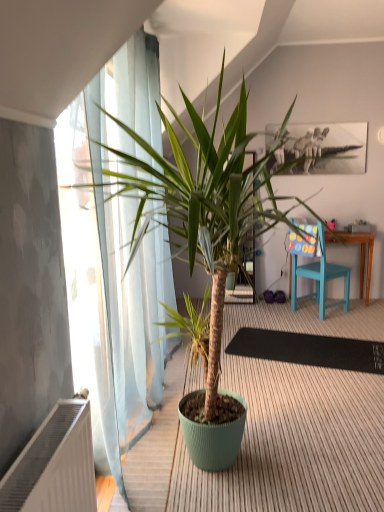
Locate an element on the screen. white plastic radiator at lower left is located at coordinates (54, 465).

What do you see at coordinates (144, 245) in the screenshot?
I see `green matte plant pot at center` at bounding box center [144, 245].

Locate an element on the screen. This screenshot has height=512, width=384. white plastic radiator at lower left is located at coordinates (54, 465).

You are a GUI agent. You are given a task and a screenshot of the screen. Output one action in this format:
    pyautogui.click(x=<x>, y=<y>)
    Task: Click on the chair behind the green matte plant pot at center
    This screenshot has width=384, height=512.
    Given the screenshot: What is the action you would take?
    pyautogui.click(x=318, y=272)

In terms of height, does teal wood chair at right look taller or shorter compared to green matte plant pot at center?

teal wood chair at right is shorter than green matte plant pot at center.

Considering the sizes of objects teal wood chair at right and green matte plant pot at center in the image provided, who is wider, teal wood chair at right or green matte plant pot at center?

Wider between the two is green matte plant pot at center.

From the image's perspective, which one is positioned lower, teal wood chair at right or green matte plant pot at center?

green matte plant pot at center appears lower in the image.

Which is more to the right, black rubber mat at center or teal wood chair at right?

Positioned to the right is teal wood chair at right.

From a real-world perspective, between black rubber mat at center and teal wood chair at right, who is vertically lower?

black rubber mat at center, from a real-world perspective.

Is teal wood chair at right at the back of black rubber mat at center?

No, teal wood chair at right is not at the back of black rubber mat at center.

Considering the sizes of objects black rubber mat at center and teal wood chair at right in the image provided, who is taller, black rubber mat at center or teal wood chair at right?

With more height is teal wood chair at right.

From a real-world perspective, between black rubber mat at center and green matte plant pot at center, who is vertically lower?

From a 3D spatial view, black rubber mat at center is below.

Is black rubber mat at center aimed at green matte plant pot at center?

No, black rubber mat at center is not oriented towards green matte plant pot at center.

Which of these two, black rubber mat at center or green matte plant pot at center, is wider?

black rubber mat at center is wider.

Does black rubber mat at center have a lesser height compared to green matte plant pot at center?

Yes, black rubber mat at center is shorter than green matte plant pot at center.

Does teal wood chair at right have a greater height compared to black rubber mat at center?

Indeed, teal wood chair at right has a greater height compared to black rubber mat at center.

How different are the orientations of teal wood chair at right and black rubber mat at center in degrees?

They differ by 54.6 degrees in their facing directions.

Between teal wood chair at right and black rubber mat at center, which one has larger size?

teal wood chair at right is bigger.

In the scene shown: How far apart are teal wood chair at right and black rubber mat at center?

The distance of teal wood chair at right from black rubber mat at center is 32.77 inches.

Would you consider teal wood chair at right to be distant from white plastic radiator at lower left?

teal wood chair at right is positioned a significant distance from white plastic radiator at lower left.

Based on the photo, is teal wood chair at right thinner than white plastic radiator at lower left?

No.

From the image's perspective, which object appears higher, teal wood chair at right or white plastic radiator at lower left?

teal wood chair at right is shown above in the image.

Which is in front, teal wood chair at right or white plastic radiator at lower left?

white plastic radiator at lower left is closer to the camera.

Considering their positions, is green matte plant pot at center located in front of or behind teal wood chair at right?

In the image, green matte plant pot at center appears in front of teal wood chair at right.

In terms of size, does green matte plant pot at center appear bigger or smaller than teal wood chair at right?

In the image, green matte plant pot at center appears to be larger than teal wood chair at right.

Identify the location of chair that is under the green matte plant pot at center (from a real-world perspective). (318, 272).

Is black rubber mat at center facing towards white plastic radiator at lower left?

No, black rubber mat at center is not aimed at white plastic radiator at lower left.

The width and height of the screenshot is (384, 512). What are the coordinates of `radiator located below the black rubber mat at center (from the image's perspective)` in the screenshot? It's located at (54, 465).

Does point (359, 360) appear closer or farther from the camera than point (73, 505)?

Point (359, 360).

Can we say black rubber mat at center lies outside white plastic radiator at lower left?

Yes, black rubber mat at center is not within white plastic radiator at lower left.

The image size is (384, 512). Find the location of `houseplant that appears in front of the teal wood chair at right`. houseplant that appears in front of the teal wood chair at right is located at coordinates (144, 245).

Image resolution: width=384 pixels, height=512 pixels. Identify the location of mat below the teal wood chair at right (from the image's perspective). (308, 349).

Considering their positions, is black rubber mat at center positioned further to teal wood chair at right than white plastic radiator at lower left?

white plastic radiator at lower left lies further to teal wood chair at right than the other object.

From the image, which object appears to be farther from white plastic radiator at lower left, teal wood chair at right or black rubber mat at center?

The object further to white plastic radiator at lower left is teal wood chair at right.

When comparing their distances from white plastic radiator at lower left, does black rubber mat at center or teal wood chair at right seem further?

teal wood chair at right lies further to white plastic radiator at lower left than the other object.

From the image, which object appears to be farther from green matte plant pot at center, teal wood chair at right or black rubber mat at center?

teal wood chair at right.

Estimate the real-world distances between objects in this image. Which object is further from white plastic radiator at lower left, green matte plant pot at center or teal wood chair at right?

teal wood chair at right is further to white plastic radiator at lower left.

Which object lies further to the anchor point teal wood chair at right, white plastic radiator at lower left or black rubber mat at center?

white plastic radiator at lower left is further to teal wood chair at right.

Based on their spatial positions, is teal wood chair at right or white plastic radiator at lower left closer to green matte plant pot at center?

white plastic radiator at lower left.

When comparing their distances from black rubber mat at center, does white plastic radiator at lower left or teal wood chair at right seem further?

white plastic radiator at lower left lies further to black rubber mat at center than the other object.

Image resolution: width=384 pixels, height=512 pixels. I want to click on mat located between green matte plant pot at center and teal wood chair at right in the depth direction, so click(308, 349).

This screenshot has height=512, width=384. Identify the location of houseplant between white plastic radiator at lower left and teal wood chair at right from front to back. (144, 245).

In order to click on houseplant between white plastic radiator at lower left and black rubber mat at center in the front-back direction in this screenshot , I will do `click(144, 245)`.

I want to click on mat between white plastic radiator at lower left and teal wood chair at right in the front-back direction, so click(308, 349).